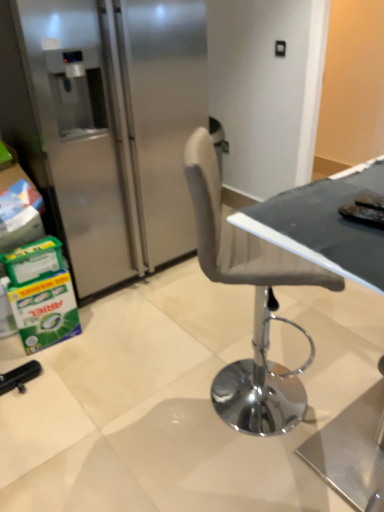
Question: Is matte black table at center taller or shorter than satin silver refrigerator at left?

Choices:
 (A) tall
 (B) short

Answer: (B)

Question: Looking at their shapes, would you say matte black table at center is wider or thinner than satin silver refrigerator at left?

Choices:
 (A) wide
 (B) thin

Answer: (B)

Question: Do you think matte black table at center is within satin silver refrigerator at left, or outside of it?

Choices:
 (A) outside
 (B) inside

Answer: (A)

Question: Considering their positions, is satin silver refrigerator at left located in front of or behind matte black table at center?

Choices:
 (A) behind
 (B) front

Answer: (A)

Question: From the image's perspective, is satin silver refrigerator at left located above or below matte black table at center?

Choices:
 (A) above
 (B) below

Answer: (A)

Question: Choose the correct answer: Is satin silver refrigerator at left inside matte black table at center or outside it?

Choices:
 (A) inside
 (B) outside

Answer: (B)

Question: Based on their positions, is satin silver refrigerator at left located to the left or right of matte black table at center?

Choices:
 (A) left
 (B) right

Answer: (A)